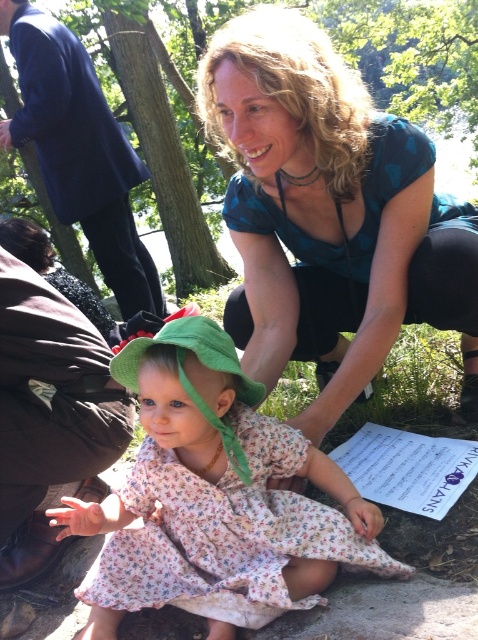
You are a photographer trying to capture a group photo of the blue printed dress at center and the floral cotton dress at center. Since the dresses have different widths, you need to adjust their positions so that both are fully visible in the frame. Which dress should be placed closer to the edge of the frame to accommodate its larger width?

The blue printed dress at center should be placed closer to the edge of the frame because its width surpasses that of the floral cotton dress at center, allowing more space for it within the frame.